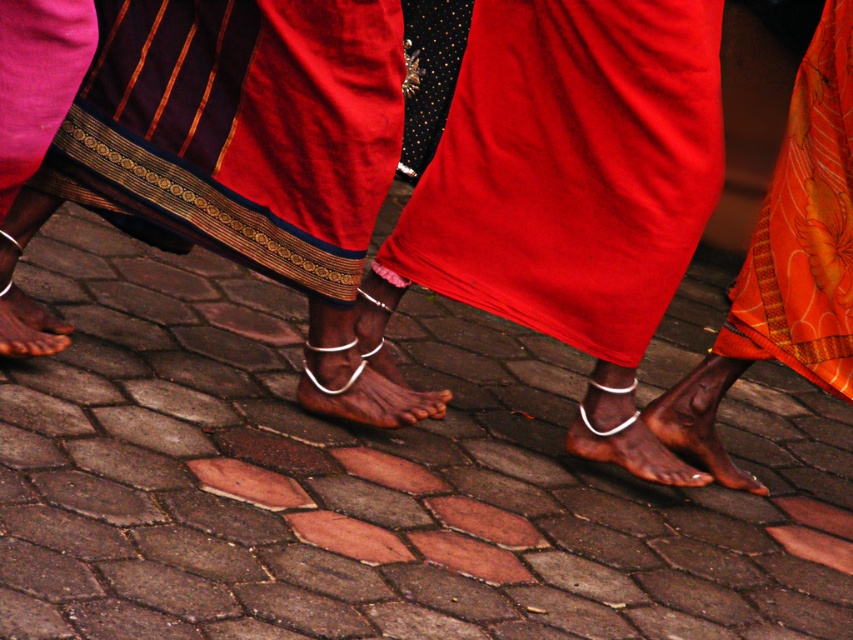
Is brown hexagonal paving stone at center to the right of matte red fabric at center from the viewer's perspective?

In fact, brown hexagonal paving stone at center is to the left of matte red fabric at center.

Between brown hexagonal paving stone at center and matte red fabric at center, which one has more height?

brown hexagonal paving stone at center

Describe the element at coordinates (374, 477) in the screenshot. This screenshot has height=640, width=853. I see `brown hexagonal paving stone at center` at that location.

What are the coordinates of `brown hexagonal paving stone at center` in the screenshot? It's located at (374, 477).

Which is more to the left, brown hexagonal paving stone at center or brown matte foot at lower left?

brown matte foot at lower left is more to the left.

Is brown hexagonal paving stone at center above brown matte foot at lower left?

Actually, brown hexagonal paving stone at center is below brown matte foot at lower left.

Where is `brown hexagonal paving stone at center`? The width and height of the screenshot is (853, 640). brown hexagonal paving stone at center is located at coordinates (374, 477).

Where is `brown hexagonal paving stone at center`? brown hexagonal paving stone at center is located at coordinates (374, 477).

Which of these two, brown hexagonal paving stone at center or orange floral fabric at lower right, stands shorter?

Standing shorter between the two is orange floral fabric at lower right.

Who is more forward, (785,470) or (817,93)?

Positioned in front is point (817,93).

I want to click on brown hexagonal paving stone at center, so click(374, 477).